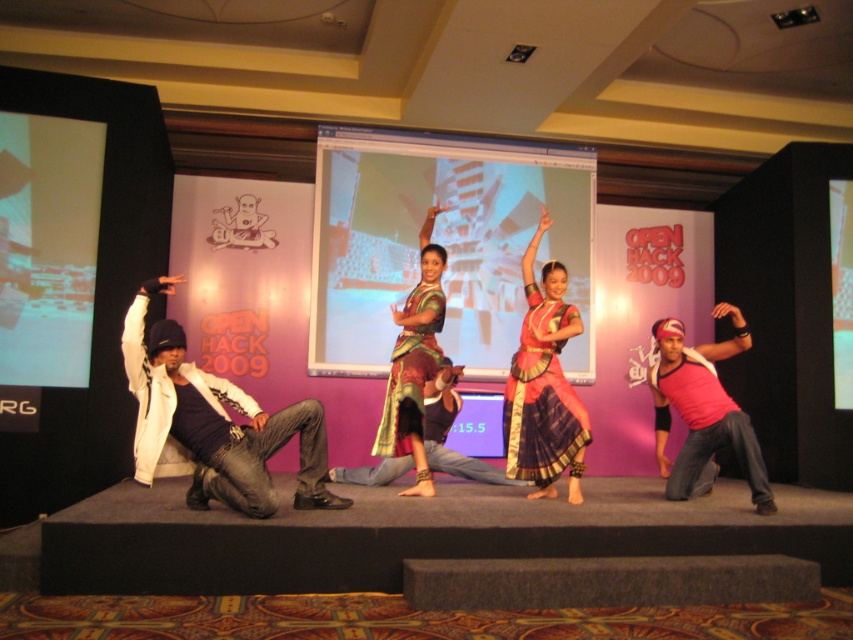
Question: Which point appears farthest from the camera in this image?

Choices:
 (A) (665, 493)
 (B) (517, 413)
 (C) (412, 436)

Answer: (A)

Question: Which point is closer to the camera?

Choices:
 (A) silk sari at center
 (B) white leather jacket at left

Answer: (B)

Question: Does pink fabric shirt at center appear on the right side of matte brown saree at center?

Choices:
 (A) no
 (B) yes

Answer: (B)

Question: Can you confirm if white leather jacket at left is thinner than silk sari at center?

Choices:
 (A) no
 (B) yes

Answer: (A)

Question: Which object is closer to the camera taking this photo?

Choices:
 (A) pink fabric shirt at center
 (B) white leather jacket at left

Answer: (B)

Question: Can you confirm if silk sari at center is positioned above matte brown saree at center?

Choices:
 (A) no
 (B) yes

Answer: (A)